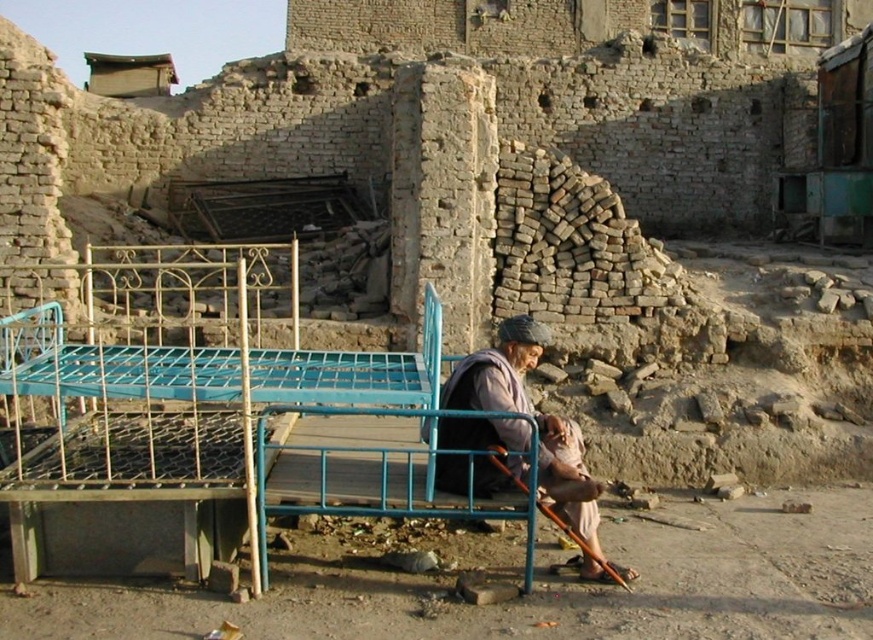
Question: Can you confirm if blue metal bed at center is positioned to the right of light brown fabric at center?

Choices:
 (A) yes
 (B) no

Answer: (B)

Question: Can you confirm if blue metal bed at center is bigger than light brown fabric at center?

Choices:
 (A) yes
 (B) no

Answer: (A)

Question: Which point is closer to the camera?

Choices:
 (A) light brown fabric at center
 (B) blue metal bed at center

Answer: (B)

Question: Does blue metal bed at center come in front of light brown fabric at center?

Choices:
 (A) yes
 (B) no

Answer: (A)

Question: Among these objects, which one is farthest from the camera?

Choices:
 (A) blue metal bed at center
 (B) light brown fabric at center

Answer: (B)